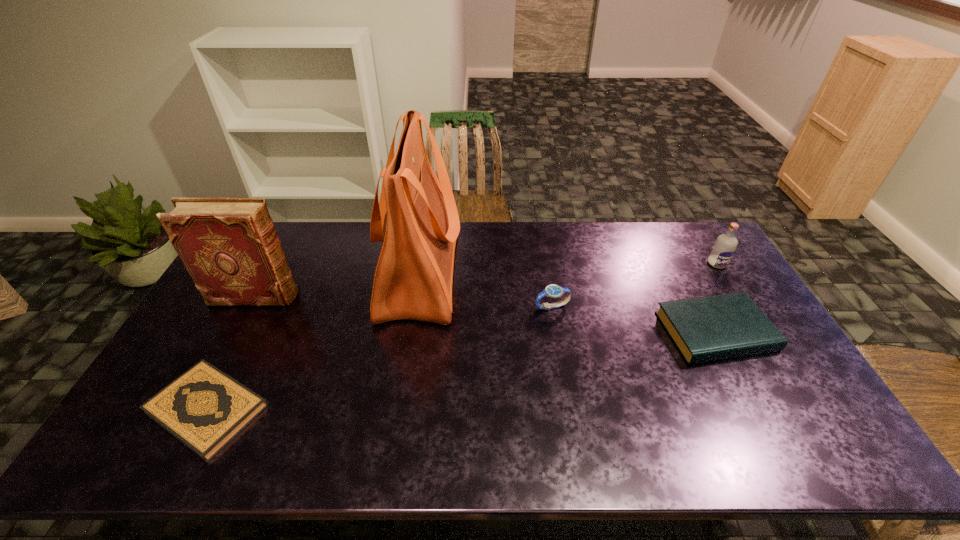
I want to click on object that is at the near left corner, so pos(204,408).

This screenshot has width=960, height=540. I want to click on object positioned at the far right corner, so click(x=724, y=247).

In the image, there is a desktop. In order to click on vacant space at the far edge in this screenshot , I will do `click(499, 232)`.

In the image, there is a desktop. Where is `vacant area at the near edge`? The image size is (960, 540). vacant area at the near edge is located at coordinates (411, 446).

In the image, there is a desktop. Where is `blank space at the left edge`? This screenshot has width=960, height=540. blank space at the left edge is located at coordinates (254, 313).

You are a GUI agent. You are given a task and a screenshot of the screen. Output one action in this format:
    pyautogui.click(x=<x>, y=<y>)
    Task: Click on the empty space that is in between the third tallest object and the shortest object
    This screenshot has height=540, width=960.
    Given the screenshot: What is the action you would take?
    pyautogui.click(x=463, y=336)

I want to click on empty space that is in between the shopping bag and the vodka, so click(x=568, y=268).

Locate an element on the screen. The image size is (960, 540). vacant area between the third object from left to right and the third object from right to left is located at coordinates coord(486,289).

In order to click on free space that is in between the third object from left to right and the vodka in this screenshot , I will do `click(568, 268)`.

Where is `vacant area that lies between the shortest object and the fourth object from left to right`? The width and height of the screenshot is (960, 540). vacant area that lies between the shortest object and the fourth object from left to right is located at coordinates (380, 358).